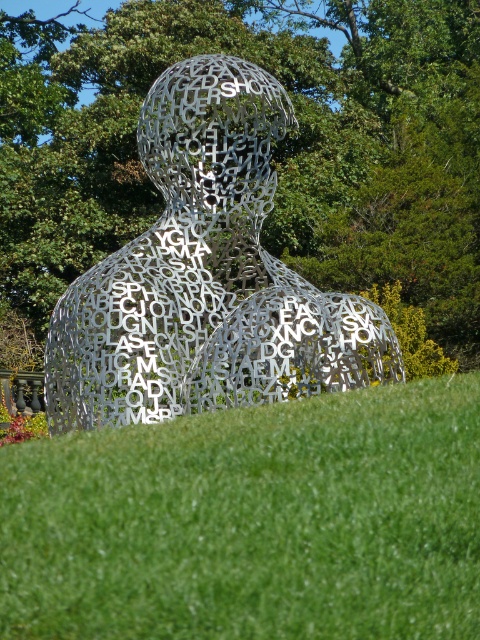
Can you confirm if green grass at center is positioned below metallic silver sculpture at center?

Correct, green grass at center is located below metallic silver sculpture at center.

Can you confirm if green grass at center is shorter than metallic silver sculpture at center?

Indeed, green grass at center has a lesser height compared to metallic silver sculpture at center.

Measure the distance between point (130, 625) and camera.

Point (130, 625) is 5.09 meters away from camera.

This screenshot has height=640, width=480. Identify the location of green grass at center. (252, 522).